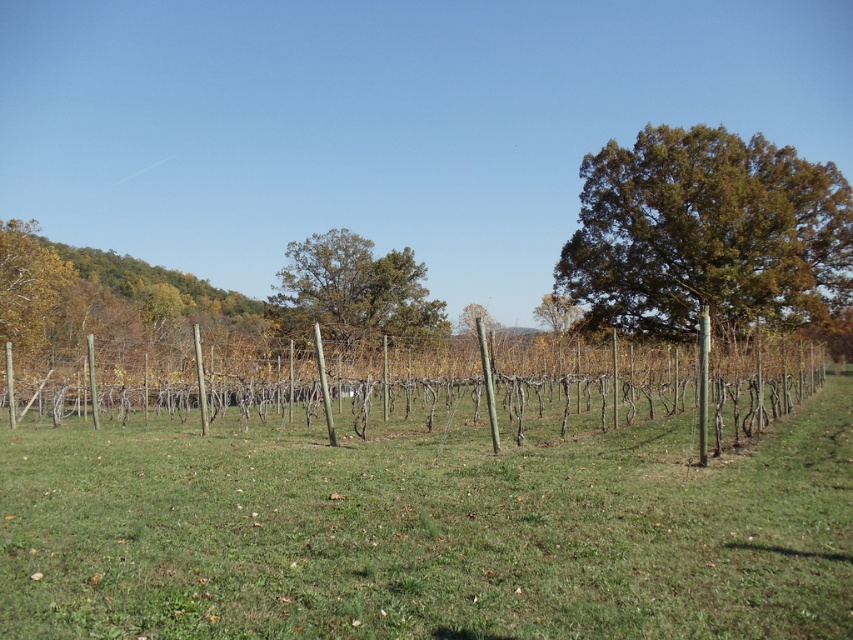
Does wooden posts at center appear over green leafy tree at center?

Actually, wooden posts at center is below green leafy tree at center.

Who is lower down, wooden posts at center or green leafy tree at center?

wooden posts at center is below.

What do you see at coordinates (451, 397) in the screenshot?
I see `wooden posts at center` at bounding box center [451, 397].

At what (x,y) coordinates should I click in order to perform the action: click on wooden posts at center. Please return your answer as a coordinate pair (x, y). Looking at the image, I should click on (451, 397).

From the picture: Does wooden posts at center have a smaller size compared to brown textured tree at upper right?

Yes, wooden posts at center is smaller than brown textured tree at upper right.

Between point (405, 410) and point (624, 321), which one is positioned in front?

Point (405, 410) is more forward.

In order to click on wooden posts at center in this screenshot , I will do `click(451, 397)`.

Is green leafy tree at left shorter than brown rough tree at center?

No, green leafy tree at left is not shorter than brown rough tree at center.

Between green leafy tree at left and brown rough tree at center, which one has less height?

brown rough tree at center is shorter.

Which is behind, point (135, 292) or point (550, 323)?

Positioned behind is point (550, 323).

Identify the location of green leafy tree at left. The width and height of the screenshot is (853, 640). (99, 296).